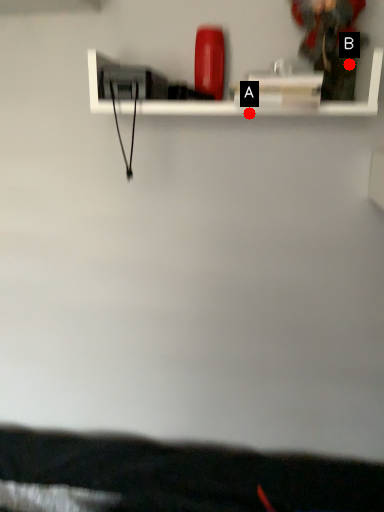
Question: Two points are circled on the image, labeled by A and B beside each circle. Which of the following is the farthest from the observer?

Choices:
 (A) A is further
 (B) B is further

Answer: (B)